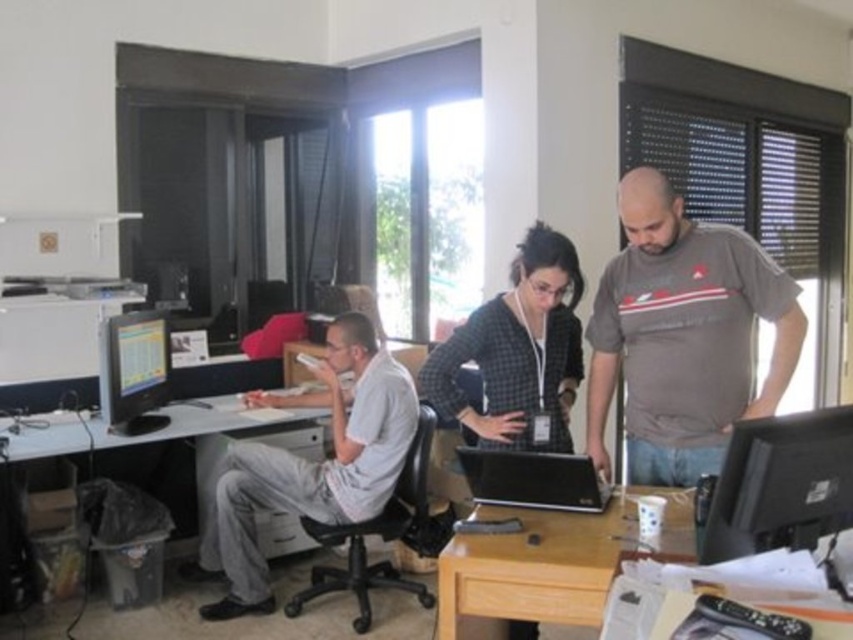
You are a new employee in the office and need to locate the matte black monitor at right. From the perspective of the checkered fabric shirt at center, where should you look relative to it?

The matte black monitor at right is below the checkered fabric shirt at center.